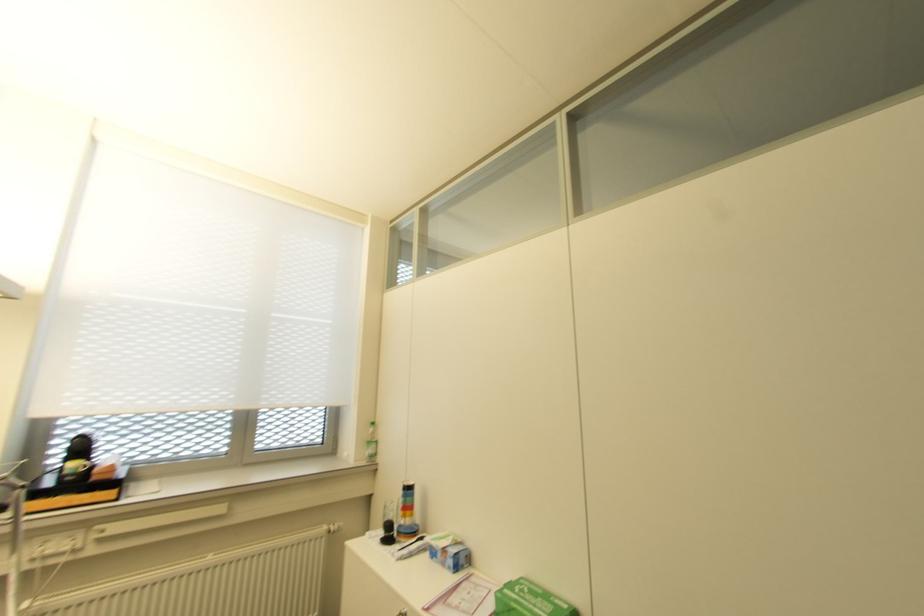
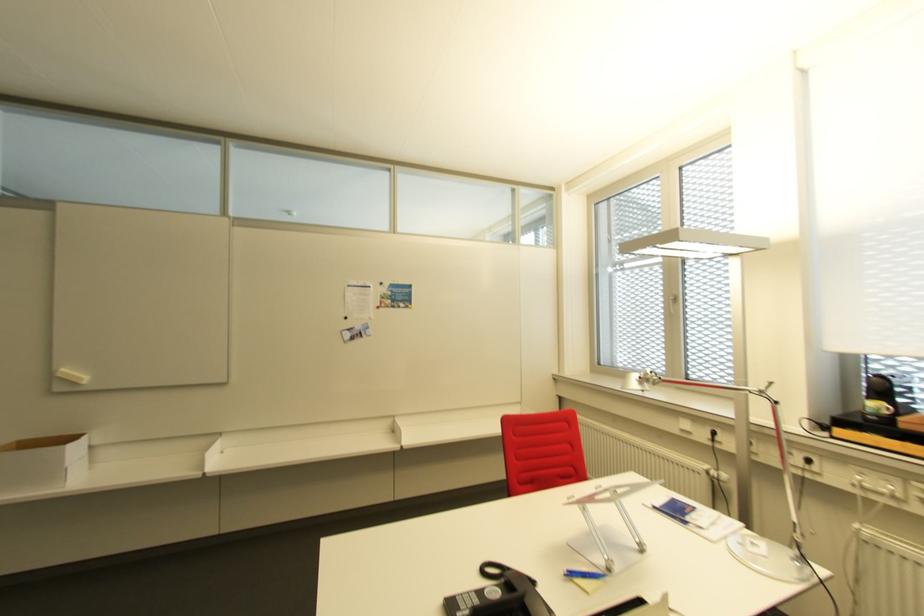
Question: How did the camera likely rotate?

Choices:
 (A) Left
 (B) Right
 (C) Up
 (D) Down

Answer: (A)